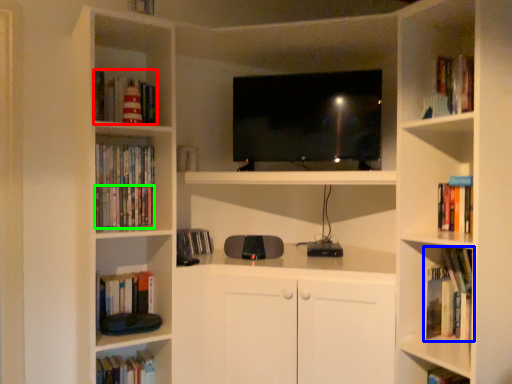
Question: Which object is positioned farthest from book (highlighted by a red box)? Select from book (highlighted by a blue box) and book (highlighted by a green box).

Choices:
 (A) book
 (B) book

Answer: (A)